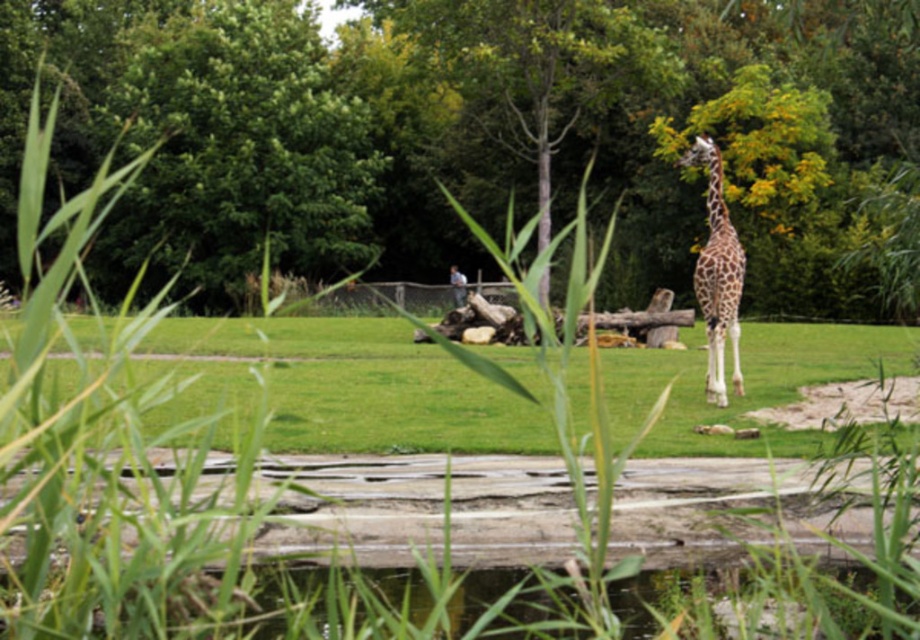
Question: Which object appears farthest from the camera in this image?

Choices:
 (A) green leafy tree at upper center
 (B) green grassy at center
 (C) green leafy tree at upper left

Answer: (C)

Question: Estimate the real-world distances between objects in this image. Which object is farther from the green leafy tree at center?

Choices:
 (A) green grassy at center
 (B) spotted fur giraffe at right
 (C) green leafy tree at upper center
 (D) green leafy tree at upper left

Answer: (A)

Question: Is green leafy tree at upper center below green leafy tree at upper left?

Choices:
 (A) yes
 (B) no

Answer: (A)

Question: Which object is the closest to the spotted fur giraffe at right?

Choices:
 (A) green leafy tree at upper center
 (B) green leafy tree at center
 (C) green grassy at center
 (D) green leafy tree at upper left

Answer: (C)

Question: From the image, what is the correct spatial relationship of green leafy tree at upper center in relation to green grassy at center?

Choices:
 (A) right
 (B) left

Answer: (B)

Question: Is green leafy tree at center below spotted fur giraffe at right?

Choices:
 (A) yes
 (B) no

Answer: (B)